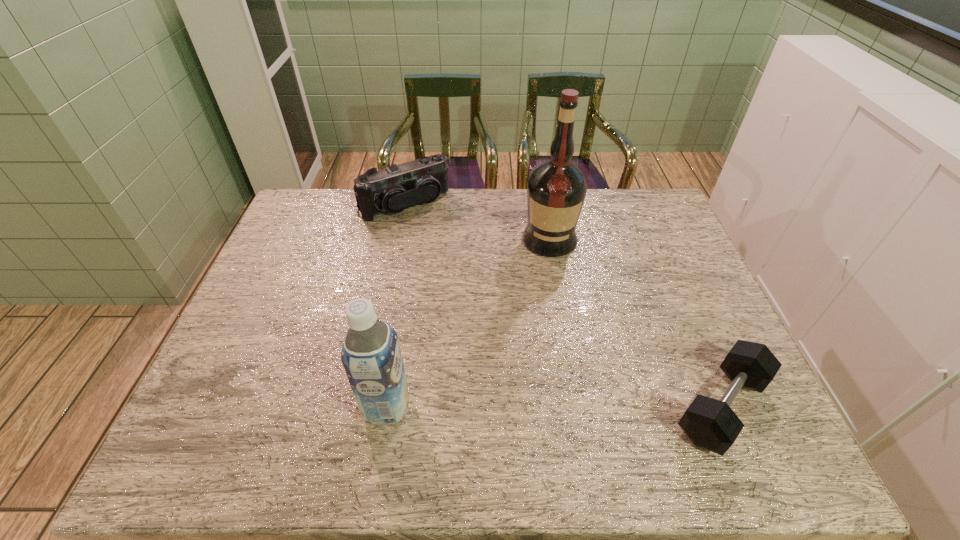
The width and height of the screenshot is (960, 540). I want to click on vacant point that satisfies the following two spatial constraints: 1. on the front side of the camcorder; 2. on the left side of the liquor, so click(398, 240).

At what (x,y) coordinates should I click in order to perform the action: click on free space that satisfies the following two spatial constraints: 1. on the front side of the camcorder; 2. on the left side of the third object from left to right. Please return your answer as a coordinate pair (x, y). This screenshot has width=960, height=540. Looking at the image, I should click on (398, 240).